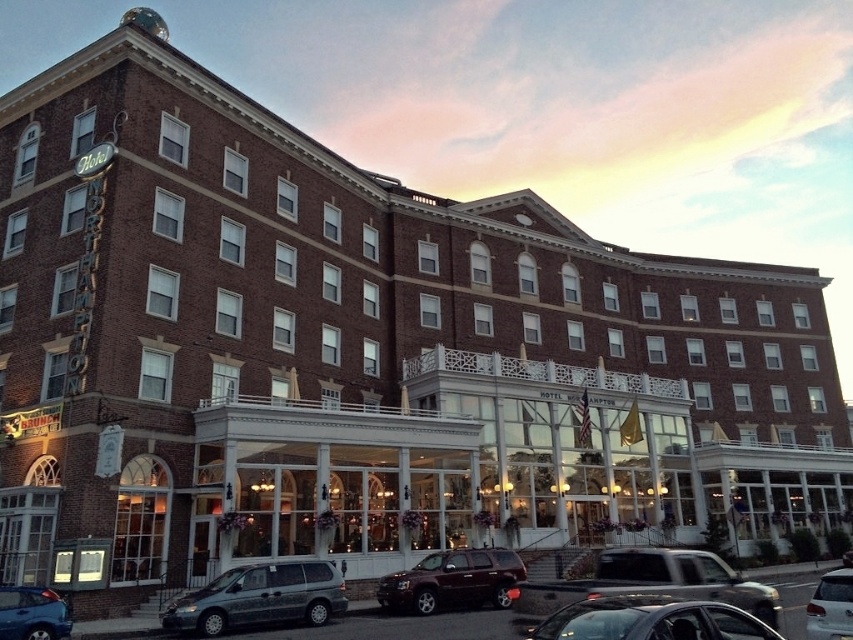
Identify the location of shiny silver sedan at lower center. (651, 620).

What do you see at coordinates (651, 620) in the screenshot? I see `shiny silver sedan at lower center` at bounding box center [651, 620].

The width and height of the screenshot is (853, 640). Find the location of `shiny silver sedan at lower center`. shiny silver sedan at lower center is located at coordinates (651, 620).

Is shiny dark brown suv at center to the left of metallic blue sedan at lower left from the viewer's perspective?

No, shiny dark brown suv at center is not to the left of metallic blue sedan at lower left.

Is shiny dark brown suv at center bigger than metallic blue sedan at lower left?

Indeed, shiny dark brown suv at center has a larger size compared to metallic blue sedan at lower left.

Measure the distance between shiny dark brown suv at center and camera.

39.14 meters

In order to click on shiny dark brown suv at center in this screenshot , I will do `click(451, 580)`.

Is point (308, 620) closer to viewer compared to point (387, 596)?

Yes, point (308, 620) is closer to viewer.

Is metallic gray minivan at lower left taller than shiny dark brown suv at center?

Incorrect, metallic gray minivan at lower left's height is not larger of shiny dark brown suv at center's.

Image resolution: width=853 pixels, height=640 pixels. Describe the element at coordinates (259, 596) in the screenshot. I see `metallic gray minivan at lower left` at that location.

This screenshot has width=853, height=640. Identify the location of metallic gray minivan at lower left. (259, 596).